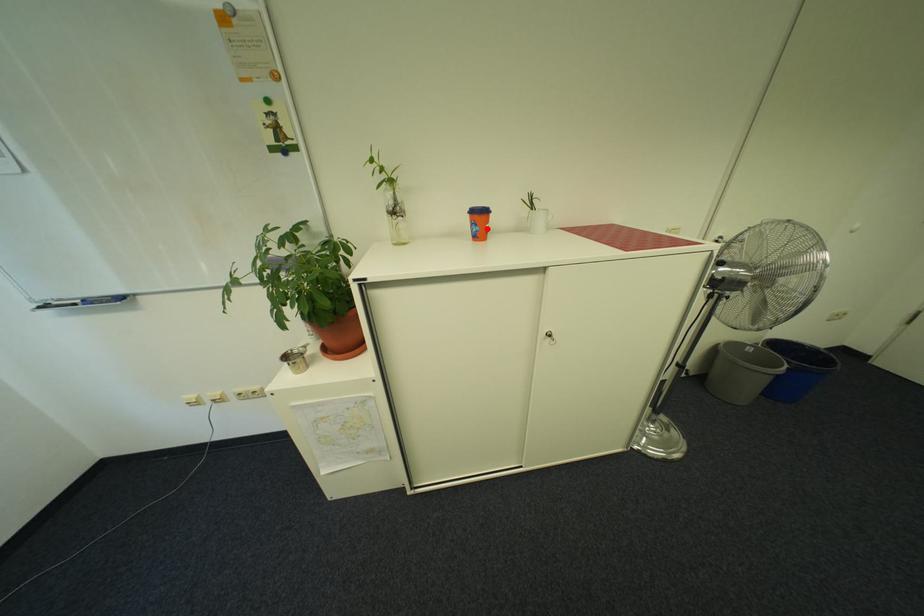
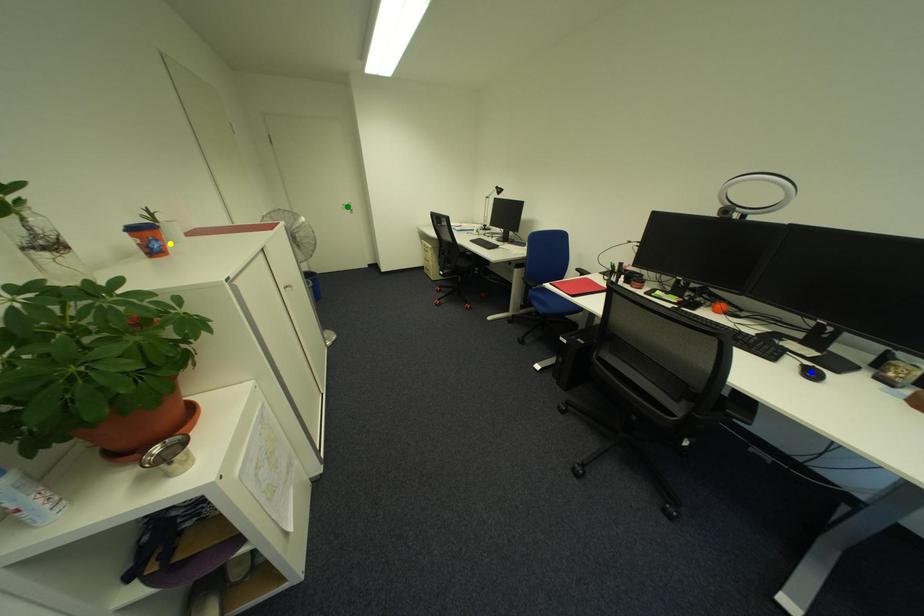
Question: I am providing you with two images of the same scene from different viewpoints. A red point is marked on the first image. You are given multiple points on the second image. In image 2, which mark is for the same physical point as the one in image 1?

Choices:
 (A) green point
 (B) yellow point
 (C) blue point

Answer: (B)